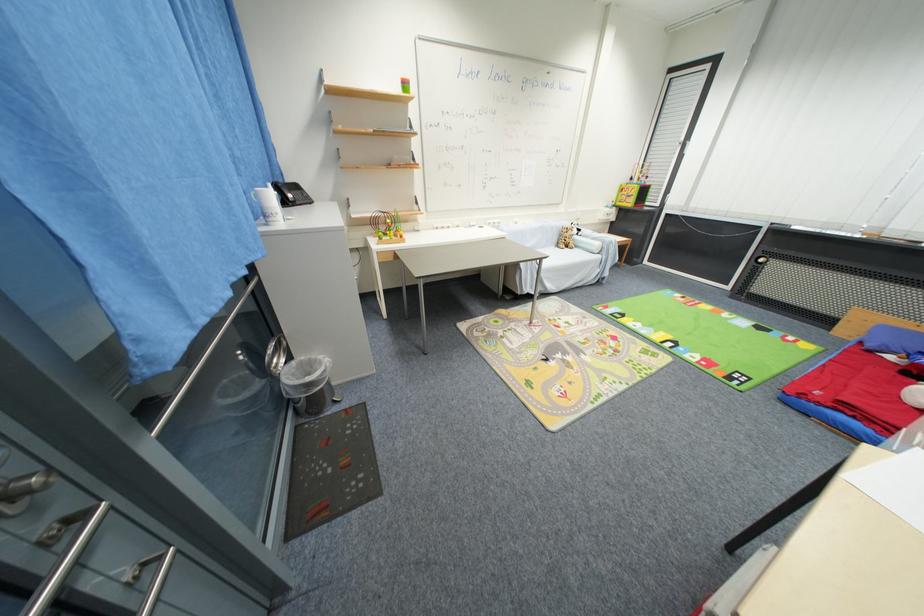
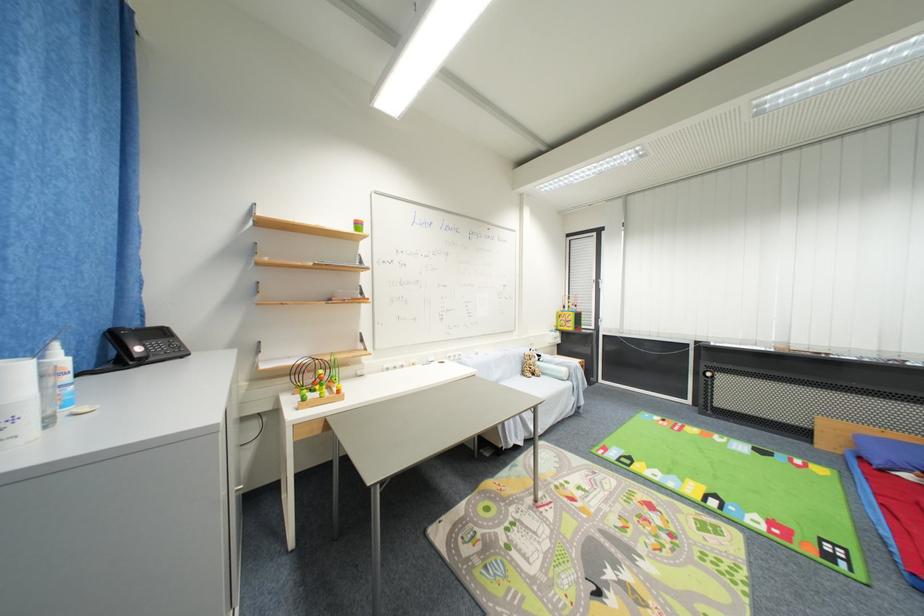
From the picture: The images are taken continuously from a first-person perspective. In which direction is your viewpoint rotating?

The rotation direction of the camera is right-up.